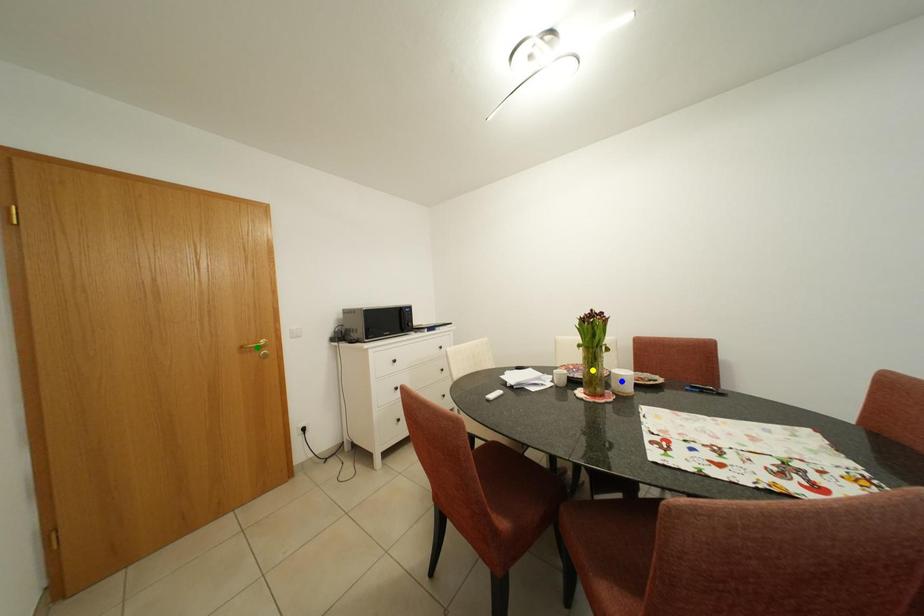
Order these from farthest to nearest:
- yellow point
- blue point
- green point

green point
yellow point
blue point